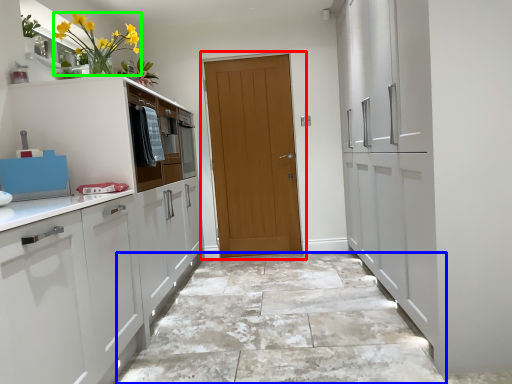
Question: Estimate the real-world distances between objects in this image. Which object is closer to door (highlighted by a red box), granite (highlighted by a blue box) or floral arrangement (highlighted by a green box)?

Choices:
 (A) granite
 (B) floral arrangement

Answer: (A)